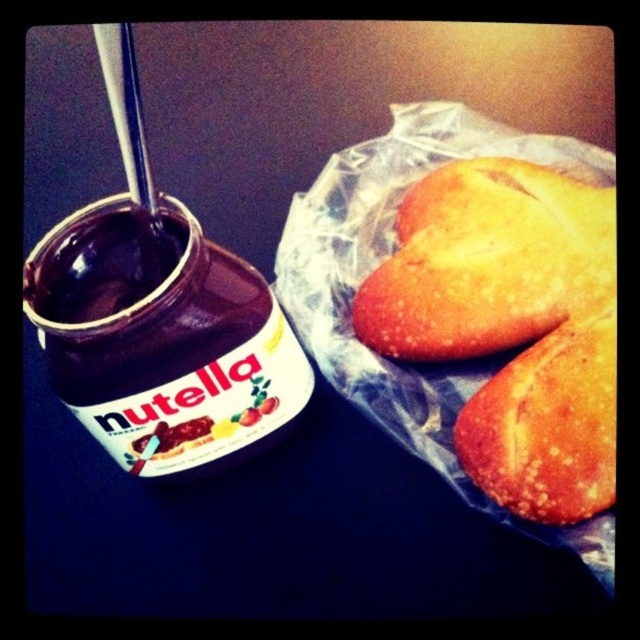
You are trying to decide which bread to use for your toast. The golden crispy bread at upper right and the golden crusty bread at right are both available. Which bread is taller?

The golden crispy bread at upper right has a greater height compared to the golden crusty bread at right, so it is taller.